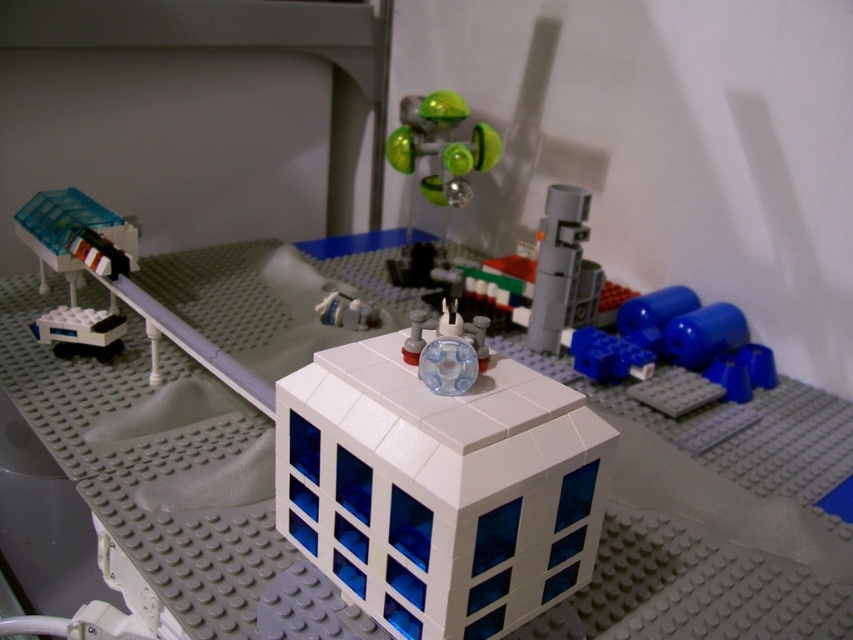
You are a Lego designer working on a new set. You need to place a new red flag exactly at the center of the baseplate. The baseplate is a square with coordinates from 0 to 1 on both axes. Given the satin gray cylinder at center is located at point 0.422, 0.660, where should you place the flag to ensure it is at the true center of the baseplate?

The true center of the baseplate would be at point (426, 320). Since the satin gray cylinder at center is at (561, 269), the flag should be placed at (426, 320) to be at the true center.